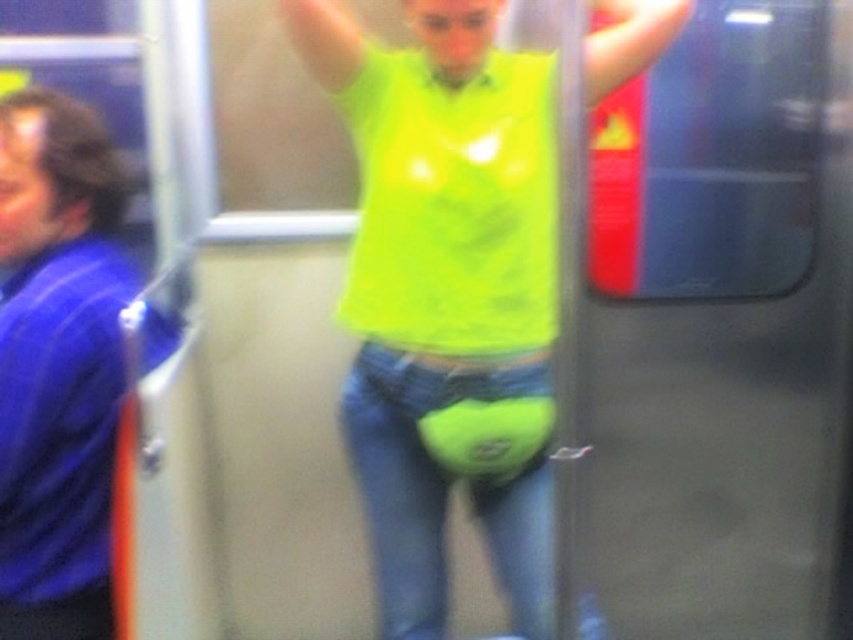
Between neon yellow fabric at center and blue fabric shirt at left, which one appears on the left side from the viewer's perspective?

Positioned to the left is blue fabric shirt at left.

Between point (444, 216) and point (65, 330), which one is positioned in front?

Positioned in front is point (65, 330).

This screenshot has width=853, height=640. I want to click on neon yellow fabric at center, so click(x=447, y=296).